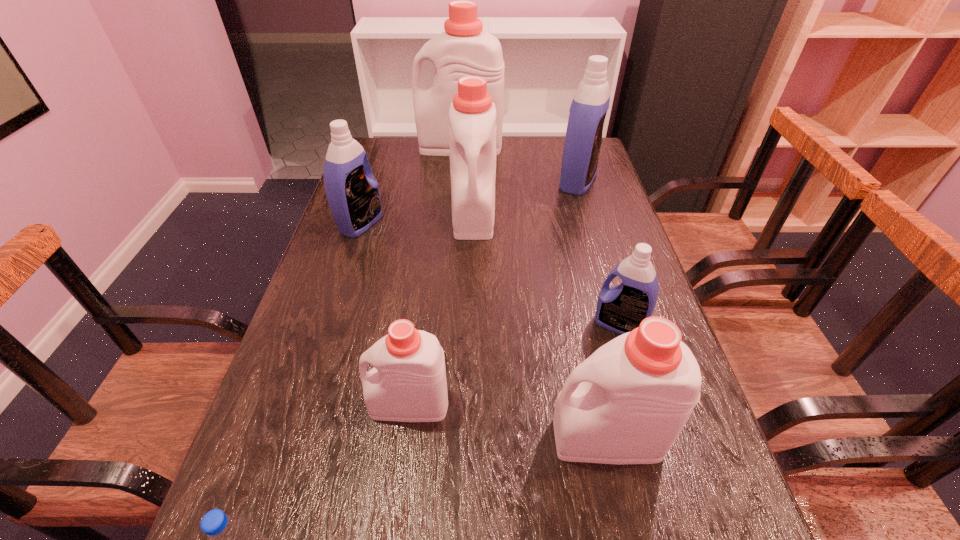
What are the coordinates of `vacant space located on the handle side of the smallest white detergent` in the screenshot? It's located at (302, 404).

This screenshot has height=540, width=960. Identify the location of vacant space located 0.180m on the handle side of the smallest white detergent. (276, 404).

Find the location of a particular element. Image resolution: width=960 pixels, height=540 pixels. free space located on the front of the nearest blue detergent is located at coordinates (677, 523).

Identify the location of object positioned at the left edge. The width and height of the screenshot is (960, 540). (353, 196).

At what (x,y) coordinates should I click in order to perform the action: click on object present at the far right corner. Please return your answer as a coordinate pair (x, y). Looking at the image, I should click on (583, 139).

Where is `blank area at the far edge`? blank area at the far edge is located at coordinates (515, 151).

You are a GUI agent. You are given a task and a screenshot of the screen. Output one action in this format:
    pyautogui.click(x=<x>, y=<y>)
    Task: Click on the vacant area at the left edge of the desktop
    This screenshot has width=960, height=540.
    Given the screenshot: What is the action you would take?
    pyautogui.click(x=343, y=316)

The width and height of the screenshot is (960, 540). In the image, there is a desktop. Identify the location of free region at the right edge. (692, 461).

You are a GUI agent. You are given a task and a screenshot of the screen. Output one action in this format:
    pyautogui.click(x=<x>, y=<y>)
    Task: Click on the vacant space at the far left corner of the desktop
    This screenshot has height=540, width=960.
    Given the screenshot: What is the action you would take?
    pyautogui.click(x=385, y=145)

At what (x,y) coordinates should I click in order to perform the action: click on blank area at the far right corner. Please return your answer as a coordinate pair (x, y). The height and width of the screenshot is (540, 960). Looking at the image, I should click on (556, 172).